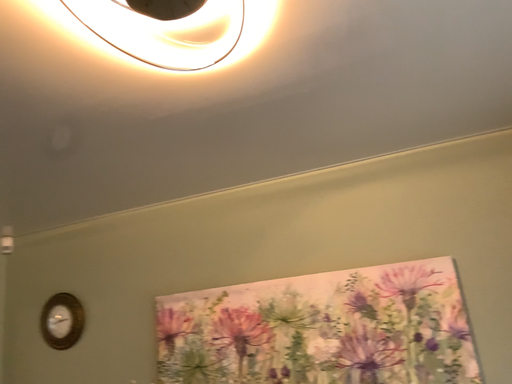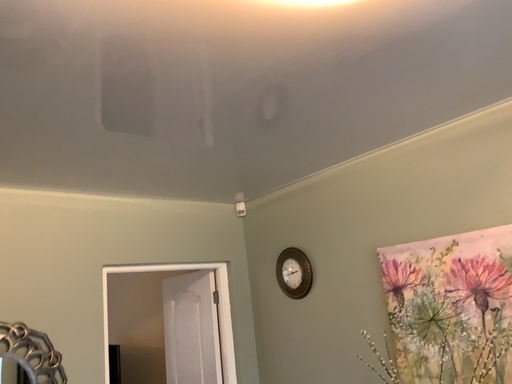
Question: Which way did the camera rotate in the video?

Choices:
 (A) rotated downward
 (B) rotated upward

Answer: (A)